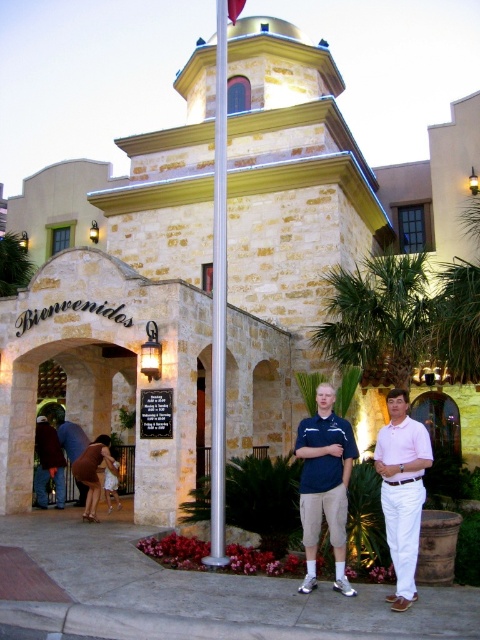
You are a photographer trying to capture a group photo of the dark blue shirt at center and the brown leather jacket at lower left. Since you want to ensure both are in focus, you need to know which one is closer to the camera. Can you determine which is closer based on their sizes?

The dark blue shirt at center is thinner than the brown leather jacket at lower left, so the dark blue shirt at center is closer to the camera.

You are standing at the entrance of the building and want to greet the two people. The blue cotton shirt at center is closer to you than the brown leather jacket at lower left. Which person should you approach first?

The blue cotton shirt at center is closer to you than the brown leather jacket at lower left, so you should approach the blue cotton shirt at center first.

You are a photographer setting up a tripod in front of the building. You want to ensure that both the pink cotton shirt at center and the brown leather jacket at lower left are visible in the frame. Considering their heights, which object should you focus on first to ensure both are in focus?

The pink cotton shirt at center is taller than the brown leather jacket at lower left. To ensure both are in focus, you should focus on the pink cotton shirt at center first, as it is the taller object and will require adjusting the focus to include the closer, shorter brown leather jacket at lower left.